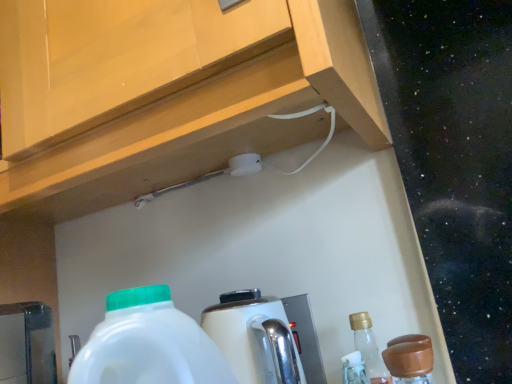
In order to click on white glossy coffee machine at center in this screenshot , I will do `click(266, 337)`.

This screenshot has width=512, height=384. What do you see at coordinates (266, 337) in the screenshot?
I see `white glossy coffee machine at center` at bounding box center [266, 337].

The image size is (512, 384). In order to click on brown matte bottle at lower right in this screenshot , I will do pyautogui.click(x=409, y=359).

What is the approximate height of brown matte bottle at lower right?

brown matte bottle at lower right is 8.42 inches tall.

The height and width of the screenshot is (384, 512). What do you see at coordinates (409, 359) in the screenshot?
I see `brown matte bottle at lower right` at bounding box center [409, 359].

Locate an element on the screen. white glossy coffee machine at center is located at coordinates (266, 337).

Does white glossy coffee machine at center appear on the right side of brown matte bottle at lower right?

In fact, white glossy coffee machine at center is to the left of brown matte bottle at lower right.

Is the depth of white glossy coffee machine at center greater than that of brown matte bottle at lower right?

Yes.

Considering the positions of point (294, 362) and point (421, 363), is point (294, 362) closer or farther from the camera than point (421, 363)?

Point (294, 362) is farther from the camera than point (421, 363).

From the image's perspective, between white glossy coffee machine at center and brown matte bottle at lower right, which one is located above?

white glossy coffee machine at center.

From a real-world perspective, who is located lower, white glossy coffee machine at center or brown matte bottle at lower right?

brown matte bottle at lower right.

Between white glossy coffee machine at center and brown matte bottle at lower right, which one has larger width?

Wider between the two is white glossy coffee machine at center.

Who is taller, white glossy coffee machine at center or brown matte bottle at lower right?

white glossy coffee machine at center is taller.

Considering the sizes of white glossy coffee machine at center and brown matte bottle at lower right in the image, is white glossy coffee machine at center bigger or smaller than brown matte bottle at lower right?

In the image, white glossy coffee machine at center appears to be larger than brown matte bottle at lower right.

Is white glossy coffee machine at center situated inside brown matte bottle at lower right or outside?

white glossy coffee machine at center is not enclosed by brown matte bottle at lower right.

Is white glossy coffee machine at center not near brown matte bottle at lower right?

Actually, white glossy coffee machine at center and brown matte bottle at lower right are a little close together.

Is white glossy coffee machine at center facing towards brown matte bottle at lower right?

No, white glossy coffee machine at center is not oriented towards brown matte bottle at lower right.

This screenshot has height=384, width=512. Find the location of `coffee machine above the brown matte bottle at lower right (from the image's perspective)`. coffee machine above the brown matte bottle at lower right (from the image's perspective) is located at coordinates (266, 337).

Between brown matte bottle at lower right and white glossy coffee machine at center, which one appears on the left side from the viewer's perspective?

Positioned to the left is white glossy coffee machine at center.

In the image, is brown matte bottle at lower right positioned in front of or behind white glossy coffee machine at center?

brown matte bottle at lower right is in front of white glossy coffee machine at center.

Is point (411, 377) more distant than point (248, 375)?

No, (411, 377) is closer to viewer.

From the image's perspective, does brown matte bottle at lower right appear higher than white glossy coffee machine at center?

No, from the image's perspective, brown matte bottle at lower right is not above white glossy coffee machine at center.

From a real-world perspective, is brown matte bottle at lower right above or below white glossy coffee machine at center?

brown matte bottle at lower right is below white glossy coffee machine at center.

Does brown matte bottle at lower right have a lesser width compared to white glossy coffee machine at center?

Yes, brown matte bottle at lower right is thinner than white glossy coffee machine at center.

Which of these two, brown matte bottle at lower right or white glossy coffee machine at center, stands taller?

Standing taller between the two is white glossy coffee machine at center.

Looking at the image, does brown matte bottle at lower right seem bigger or smaller compared to white glossy coffee machine at center?

brown matte bottle at lower right is smaller than white glossy coffee machine at center.

In the scene shown: Do you think brown matte bottle at lower right is within white glossy coffee machine at center, or outside of it?

brown matte bottle at lower right cannot be found inside white glossy coffee machine at center.

Is brown matte bottle at lower right not close to white glossy coffee machine at center?

No, brown matte bottle at lower right is not far from white glossy coffee machine at center.

Is brown matte bottle at lower right oriented away from white glossy coffee machine at center?

No, brown matte bottle at lower right's orientation is not away from white glossy coffee machine at center.

Can you tell me how much brown matte bottle at lower right and white glossy coffee machine at center differ in facing direction?

The facing directions of brown matte bottle at lower right and white glossy coffee machine at center are 0.126 degrees apart.

This screenshot has width=512, height=384. What are the coordinates of `bottle that is in front of the white glossy coffee machine at center` in the screenshot? It's located at pos(409,359).

Image resolution: width=512 pixels, height=384 pixels. In order to click on bottle below the white glossy coffee machine at center (from the image's perspective) in this screenshot , I will do `click(409, 359)`.

Locate an element on the screen. bottle to the right of white glossy coffee machine at center is located at coordinates (409, 359).